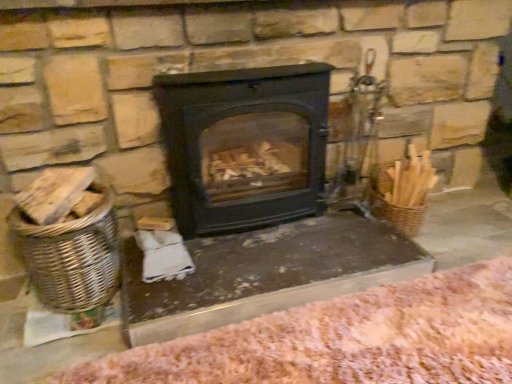
Question: In terms of size, does smooth stone table at center appear bigger or smaller than woven brown basket at left?

Choices:
 (A) big
 (B) small

Answer: (A)

Question: From a real-world perspective, is smooth stone table at center positioned above or below woven brown basket at left?

Choices:
 (A) below
 (B) above

Answer: (A)

Question: Estimate the real-world distances between objects in this image. Which object is closer to the black matte wood burning stove at center?

Choices:
 (A) pink woolen blanket at lower right
 (B) smooth stone table at center
 (C) woven brown basket at left

Answer: (B)

Question: Which of these objects is positioned closest to the smooth stone table at center?

Choices:
 (A) black matte wood burning stove at center
 (B) pink woolen blanket at lower right
 (C) woven brown basket at left

Answer: (B)